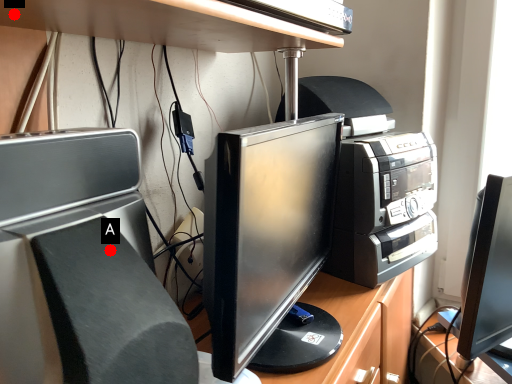
Question: Two points are circled on the image, labeled by A and B beside each circle. Which point is closer to the camera taking this photo?

Choices:
 (A) A is closer
 (B) B is closer

Answer: (A)